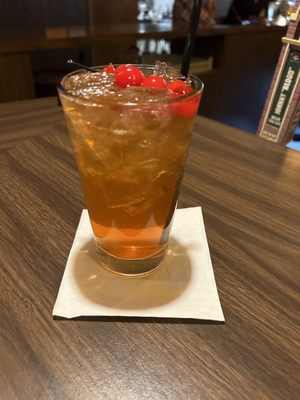
The width and height of the screenshot is (300, 400). Identify the location of box. (198, 65), (157, 269).